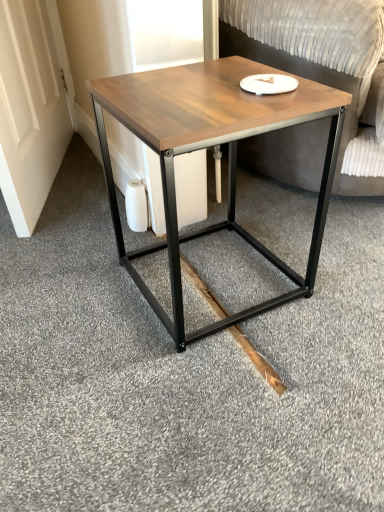
Question: From a real-world perspective, is wooden matte coffee table at center on top of wooden swivel chair at center?

Choices:
 (A) no
 (B) yes

Answer: (A)

Question: Does wooden matte coffee table at center appear on the right side of wooden swivel chair at center?

Choices:
 (A) no
 (B) yes

Answer: (A)

Question: From the image's perspective, is wooden matte coffee table at center under wooden swivel chair at center?

Choices:
 (A) yes
 (B) no

Answer: (A)

Question: Considering the relative sizes of wooden matte coffee table at center and wooden swivel chair at center in the image provided, is wooden matte coffee table at center smaller than wooden swivel chair at center?

Choices:
 (A) yes
 (B) no

Answer: (A)

Question: From a real-world perspective, is wooden matte coffee table at center under wooden swivel chair at center?

Choices:
 (A) no
 (B) yes

Answer: (B)

Question: Would you say natural wood plank at lower center is inside or outside wooden swivel chair at center?

Choices:
 (A) outside
 (B) inside

Answer: (A)

Question: Considering the relative positions of natural wood plank at lower center and wooden swivel chair at center in the image provided, is natural wood plank at lower center to the left or to the right of wooden swivel chair at center?

Choices:
 (A) left
 (B) right

Answer: (A)

Question: Considering the positions of natural wood plank at lower center and wooden swivel chair at center in the image, is natural wood plank at lower center taller or shorter than wooden swivel chair at center?

Choices:
 (A) tall
 (B) short

Answer: (B)

Question: Considering the positions of natural wood plank at lower center and wooden swivel chair at center in the image, is natural wood plank at lower center wider or thinner than wooden swivel chair at center?

Choices:
 (A) thin
 (B) wide

Answer: (A)

Question: Is point 365,179 positioned closer to the camera than point 221,92?

Choices:
 (A) farther
 (B) closer

Answer: (A)

Question: Based on their sizes in the image, would you say wooden swivel chair at center is bigger or smaller than wooden matte coffee table at center?

Choices:
 (A) small
 (B) big

Answer: (B)

Question: From a real-world perspective, is wooden swivel chair at center positioned above or below wooden matte coffee table at center?

Choices:
 (A) above
 (B) below

Answer: (A)

Question: Would you say wooden swivel chair at center is to the left or to the right of wooden matte coffee table at center in the picture?

Choices:
 (A) left
 (B) right

Answer: (B)

Question: Is wooden matte coffee table at center inside the boundaries of natural wood plank at lower center, or outside?

Choices:
 (A) outside
 (B) inside

Answer: (A)

Question: From a real-world perspective, is wooden matte coffee table at center above or below natural wood plank at lower center?

Choices:
 (A) above
 (B) below

Answer: (A)